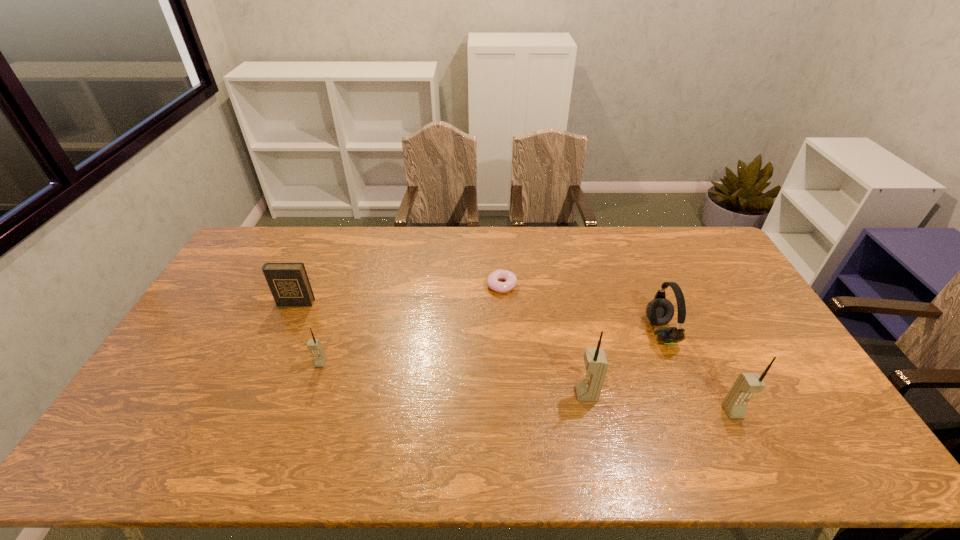
The image size is (960, 540). In order to click on free space that satisfies the following two spatial constraints: 1. on the ear cups of the headset; 2. on the front of the leftmost cellular telephone, where the keypad is located in this screenshot , I will do `click(674, 363)`.

The height and width of the screenshot is (540, 960). What are the coordinates of `free space that satisfies the following two spatial constraints: 1. on the ear cups of the second object from right to left; 2. on the front of the fifth object from right to left, where the keypad is located` in the screenshot? It's located at (674, 363).